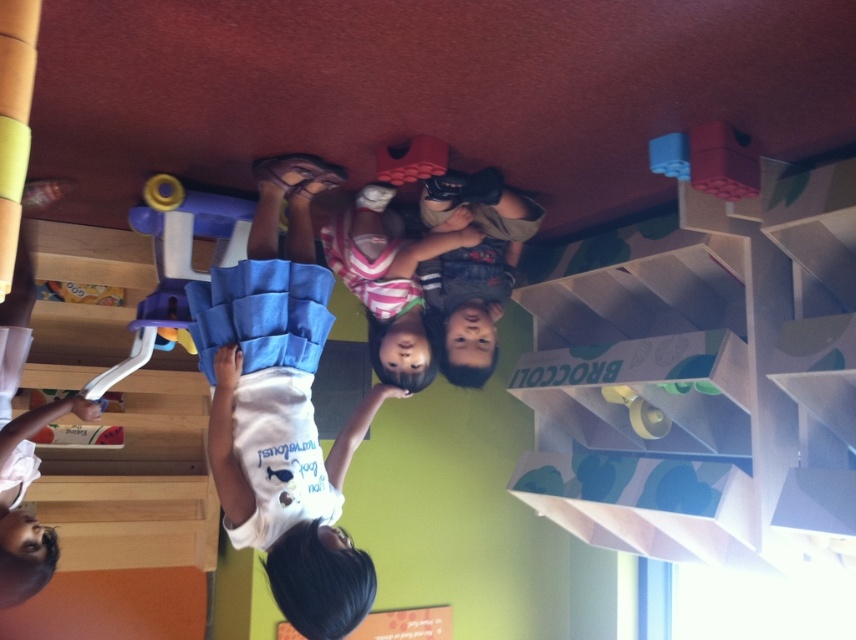
Where is the white cotton shirt at center located in the image?

The white cotton shirt at center is located at point 0.637 on the x axis and 0.331 on the y axis.

You are a photographer trying to capture a clear shot of both the white cotton shirt at center and the striped fabric shirt at center. Since the image is rotated, you need to adjust your camera angle. Which shirt should you focus on first to ensure it appears larger in your photo?

The white cotton shirt at center is closer to the viewer than the striped fabric shirt at center, so focusing on it first will make it appear larger in the photo.